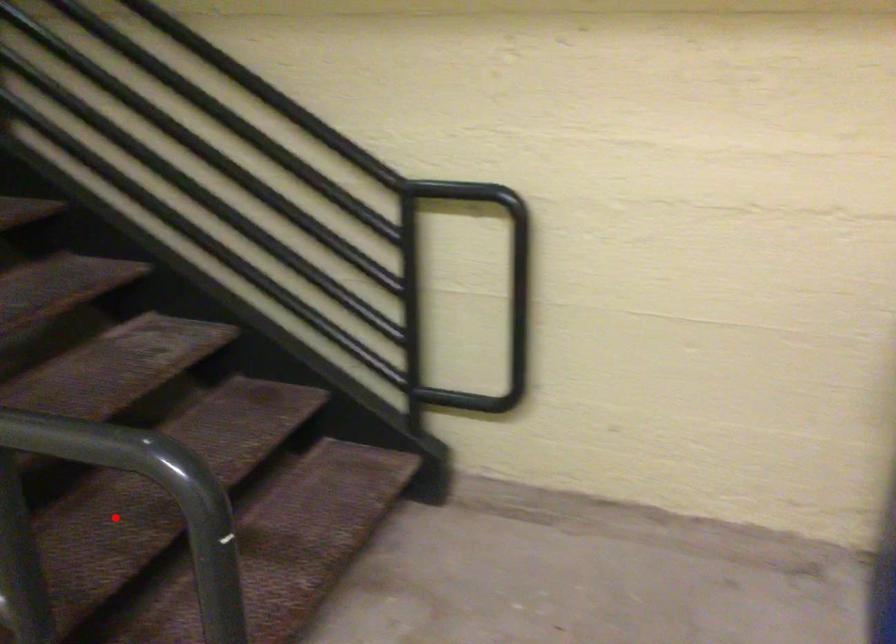
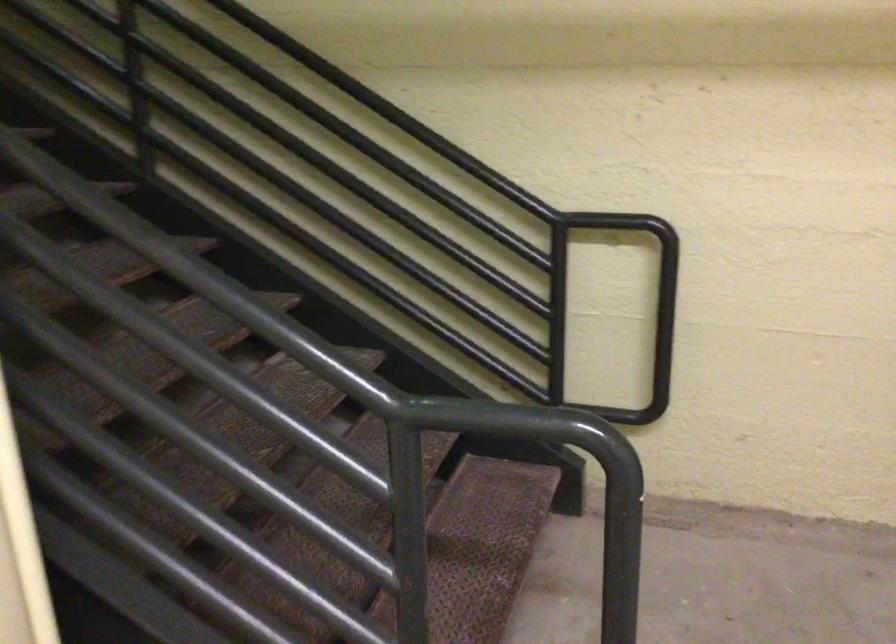
Question: I am providing you with two images of the same scene from different viewpoints. A red point is marked on the first image. Is the red point's position out of view in image 2?

Choices:
 (A) Yes
 (B) No

Answer: (A)